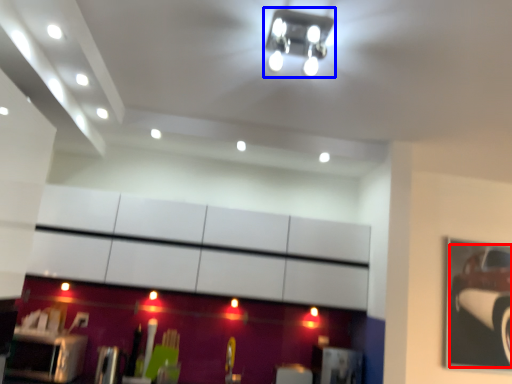
Question: Among these objects, which one is nearest to the camera, car (highlighted by a red box) or light fixture (highlighted by a blue box)?

Choices:
 (A) car
 (B) light fixture

Answer: (B)